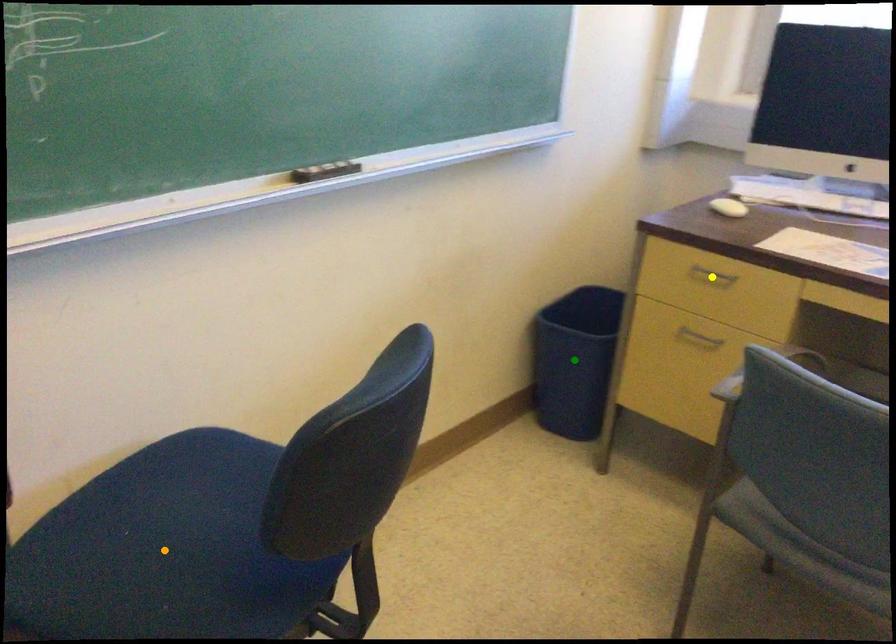
Order these from farthest to nearest:
A) orange point
B) yellow point
C) green point

green point, yellow point, orange point